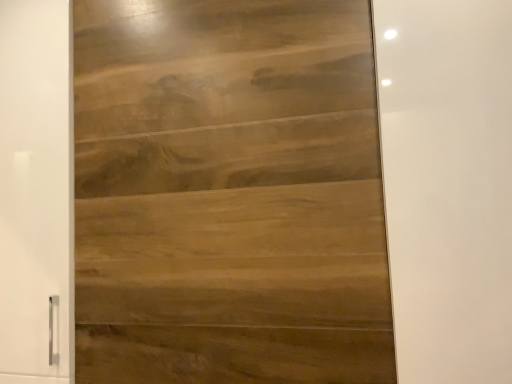
Image resolution: width=512 pixels, height=384 pixels. Find the location of `wooden panel at left`. wooden panel at left is located at coordinates (36, 191).

What is the approximate width of wooden panel at left?

It is 16.33 inches.

Image resolution: width=512 pixels, height=384 pixels. Describe the element at coordinates (36, 191) in the screenshot. I see `wooden panel at left` at that location.

What is the approximate height of satin wood door at center?

satin wood door at center is 3.51 feet in height.

Describe the element at coordinates (228, 194) in the screenshot. I see `satin wood door at center` at that location.

The height and width of the screenshot is (384, 512). I want to click on satin wood door at center, so click(228, 194).

The image size is (512, 384). Find the location of `wooden panel at left`. wooden panel at left is located at coordinates (36, 191).

Between wooden panel at left and satin wood door at center, which one appears on the right side from the viewer's perspective?

satin wood door at center.

Is the position of wooden panel at left less distant than that of satin wood door at center?

No, wooden panel at left is behind satin wood door at center.

Which is closer to the camera, (58, 5) or (346, 251)?

Point (58, 5) is farther from the camera than point (346, 251).

From the image's perspective, is wooden panel at left above or below satin wood door at center?

Clearly, from the image's perspective, wooden panel at left is below satin wood door at center.

From a real-world perspective, between wooden panel at left and satin wood door at center, who is vertically higher?

From a 3D spatial view, wooden panel at left is above.

Which object is wider, wooden panel at left or satin wood door at center?

wooden panel at left is wider.

Which of these two, wooden panel at left or satin wood door at center, stands shorter?

satin wood door at center.

Between wooden panel at left and satin wood door at center, which one has smaller size?

satin wood door at center.

Would you say satin wood door at center is part of wooden panel at left's contents?

No, satin wood door at center is not surrounded by wooden panel at left.

Consider the image. Is wooden panel at left positioned far away from satin wood door at center?

Actually, wooden panel at left and satin wood door at center are a little close together.

Is wooden panel at left positioned with its back to satin wood door at center?

No, wooden panel at left is not facing the opposite direction of satin wood door at center.

Looking at this image, how different are the orientations of wooden panel at left and satin wood door at center in degrees?

wooden panel at left and satin wood door at center are facing 0.276 degrees away from each other.

Measure the distance between wooden panel at left and satin wood door at center.

They are 13.39 inches apart.

Where is `door in front of the wooden panel at left`? This screenshot has width=512, height=384. door in front of the wooden panel at left is located at coordinates (228, 194).

Can you confirm if satin wood door at center is positioned to the left of wooden panel at left?

No.

In the image, is satin wood door at center positioned in front of or behind wooden panel at left?

In the image, satin wood door at center appears in front of wooden panel at left.

Is point (133, 231) closer or farther from the camera than point (58, 89)?

Point (133, 231) is positioned closer to the camera compared to point (58, 89).

Based on the photo, from the image's perspective, which one is positioned lower, satin wood door at center or wooden panel at left?

From the image's view, wooden panel at left is below.

From a real-world perspective, is satin wood door at center on top of wooden panel at left?

Incorrect, from a real-world perspective, satin wood door at center is lower than wooden panel at left.

Between satin wood door at center and wooden panel at left, which one has smaller width?

satin wood door at center is thinner.

Which of these two, satin wood door at center or wooden panel at left, stands taller?

wooden panel at left.

Considering the sizes of satin wood door at center and wooden panel at left in the image, is satin wood door at center bigger or smaller than wooden panel at left?

satin wood door at center is smaller than wooden panel at left.

Is satin wood door at center not within wooden panel at left?

Yes, satin wood door at center is outside of wooden panel at left.

Would you consider satin wood door at center to be distant from wooden panel at left?

satin wood door at center is actually quite close to wooden panel at left.

Could you tell me if satin wood door at center is turned towards wooden panel at left?

No, satin wood door at center is not oriented towards wooden panel at left.

Measure the distance from satin wood door at center to wooden panel at left.

satin wood door at center and wooden panel at left are 13.39 inches apart from each other.

This screenshot has width=512, height=384. In order to click on door on the right of wooden panel at left in this screenshot , I will do `click(228, 194)`.

Image resolution: width=512 pixels, height=384 pixels. Identify the location of barn door below the satin wood door at center (from the image's perspective). (36, 191).

Where is `door that appears below the wooden panel at left (from a real-world perspective)`? This screenshot has width=512, height=384. door that appears below the wooden panel at left (from a real-world perspective) is located at coordinates (x=228, y=194).